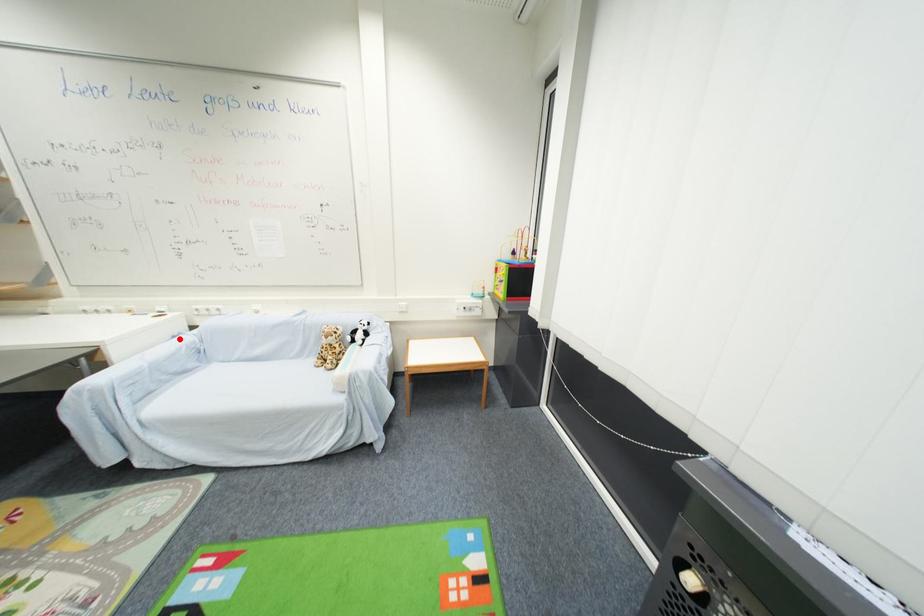
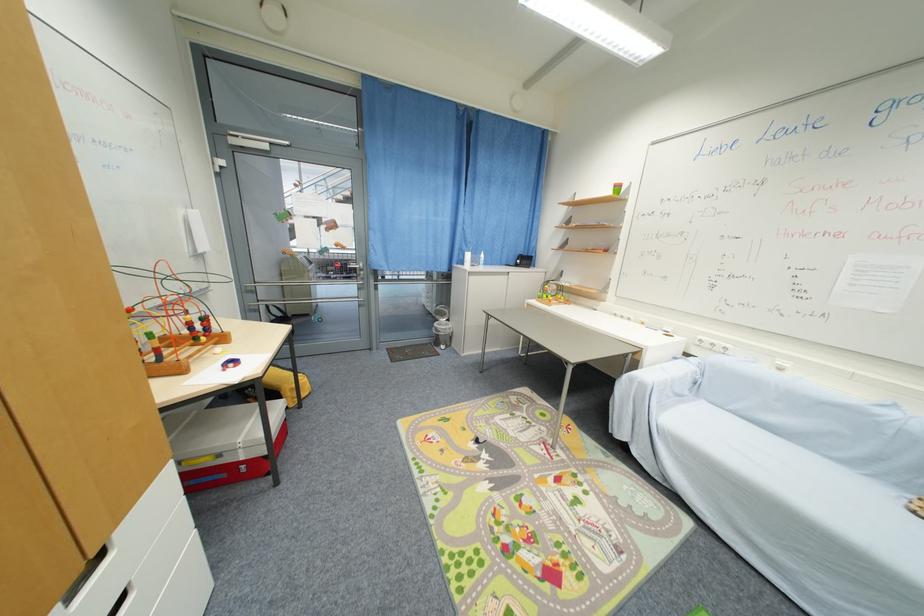
Locate, in the second image, the point that corresponds to the highlighted location in the first image.

(681, 360)